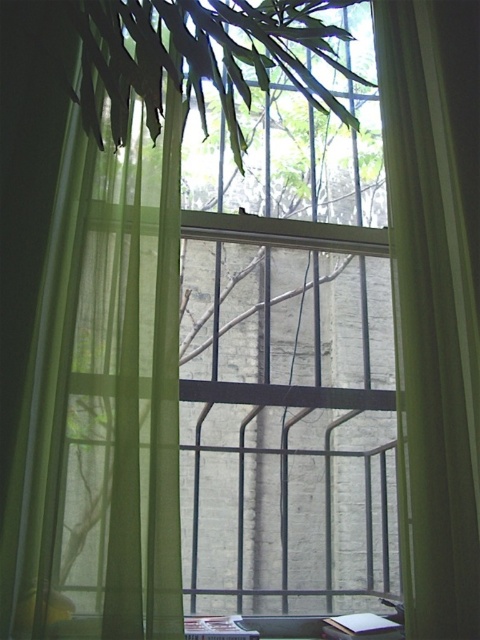
From the picture: You are an interior designer assessing the placement of the green sheer curtain at center in a room. Based on its 2D coordinates, which are located at point 0.470, 0.906, can you determine if it is positioned closer to the top or bottom of the window frame?

The green sheer curtain at center has a 2D location at point (434,300). Since the y coordinate is 0.906, which is closer to 1.0, it is positioned closer to the bottom of the window frame.

You are organizing a small party and need to determine which item can cover a larger area when placed on the table. Based on the scene, which object between the green sheer curtain at left and the white paper at bottom center is bigger?

The green sheer curtain at left is larger in size than the white paper at bottom center, so it can cover a larger area when placed on the table.

You are standing in a room and want to move from the desk to the window. The green sheer curtain at left and the green sheer curtain at center are in your way. Which curtain should you move to pass through the space closest to the window?

The green sheer curtain at left has a larger size compared to the green sheer curtain at center, so you should move the smaller green sheer curtain at center to pass through the space closest to the window.